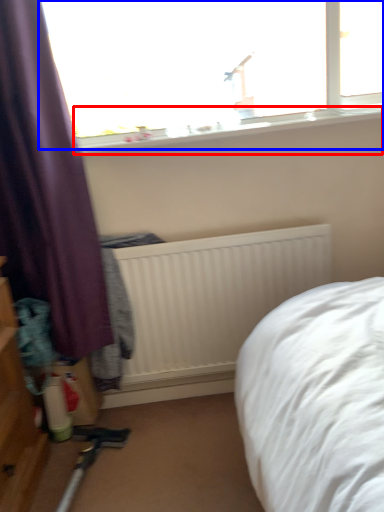
Question: Which of the following is the closest to the observer, window sill (highlighted by a red box) or window (highlighted by a blue box)?

Choices:
 (A) window sill
 (B) window

Answer: (B)